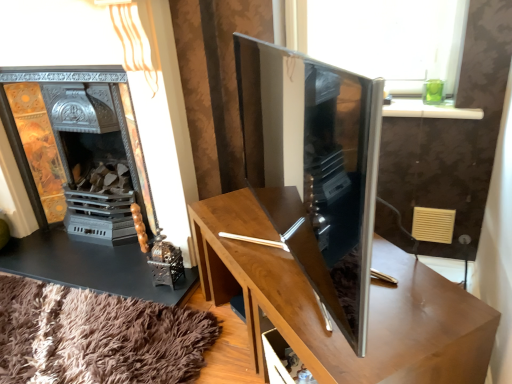
Question: Is wooden table at center inside or outside of satin wood tv cabinet at center?

Choices:
 (A) outside
 (B) inside

Answer: (A)

Question: Based on their positions, is wooden table at center located to the left or right of satin wood tv cabinet at center?

Choices:
 (A) right
 (B) left

Answer: (A)

Question: Which of these objects is positioned closest to the satin wood tv cabinet at center?

Choices:
 (A) metallic ornate fireplace at left
 (B) wooden table at center

Answer: (B)

Question: Based on their relative distances, which object is farther from the metallic ornate fireplace at left?

Choices:
 (A) satin wood tv cabinet at center
 (B) wooden table at center

Answer: (A)